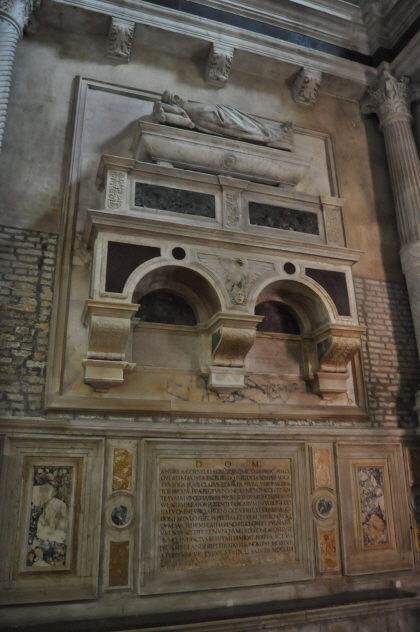
Identify the location of bird carved into wall. The height and width of the screenshot is (632, 420). (238, 276).